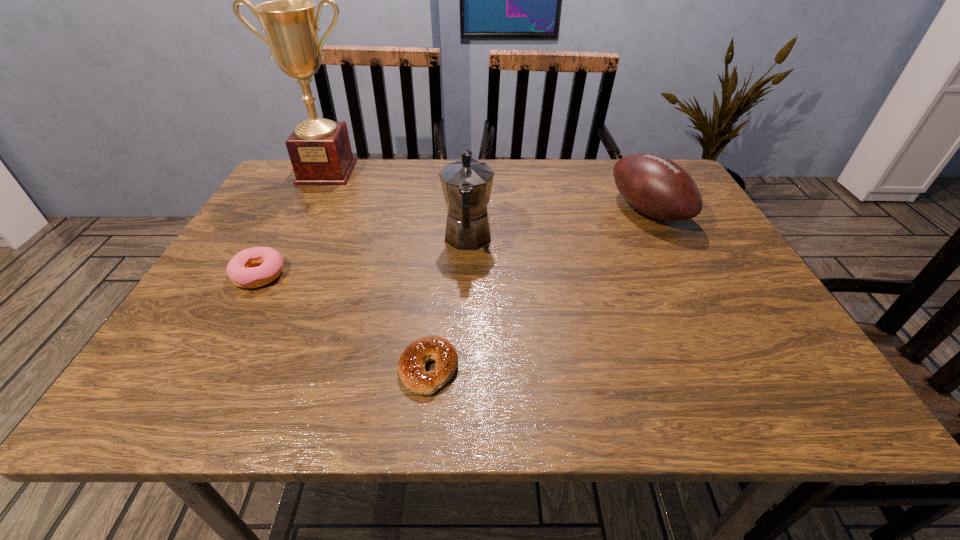
Where is `vacant area situated 0.070m on the pouring side of the second tallest object`? vacant area situated 0.070m on the pouring side of the second tallest object is located at coordinates (469, 201).

The height and width of the screenshot is (540, 960). I want to click on vacant point located 0.090m on the pouring side of the second tallest object, so click(469, 198).

At what (x,y) coordinates should I click in order to perform the action: click on vacant space situated 0.400m on the front of the third tallest object. Please return your answer as a coordinate pair (x, y). This screenshot has height=540, width=960. Looking at the image, I should click on (732, 376).

You are a GUI agent. You are given a task and a screenshot of the screen. Output one action in this format:
    pyautogui.click(x=<x>, y=<y>)
    Task: Click on the free space located 0.190m on the right of the doughnut
    This screenshot has width=960, height=540.
    Given the screenshot: What is the action you would take?
    pyautogui.click(x=372, y=275)

This screenshot has width=960, height=540. Identify the location of vacant region located 0.350m on the left of the shortest object. (202, 368).

Identify the location of trophy cup located in the far edge section of the desktop. Image resolution: width=960 pixels, height=540 pixels. tap(320, 151).

You are a GUI agent. You are given a task and a screenshot of the screen. Output one action in this format:
    pyautogui.click(x=<x>, y=<y>)
    Task: Click on the football (American) that is at the far edge
    The height and width of the screenshot is (540, 960).
    Given the screenshot: What is the action you would take?
    pyautogui.click(x=655, y=186)

Locate an element on the screen. object at the near edge is located at coordinates (411, 366).

Find the location of a particular element. trophy cup located at the left edge is located at coordinates (320, 151).

The height and width of the screenshot is (540, 960). I want to click on doughnut that is at the left edge, so [x=240, y=269].